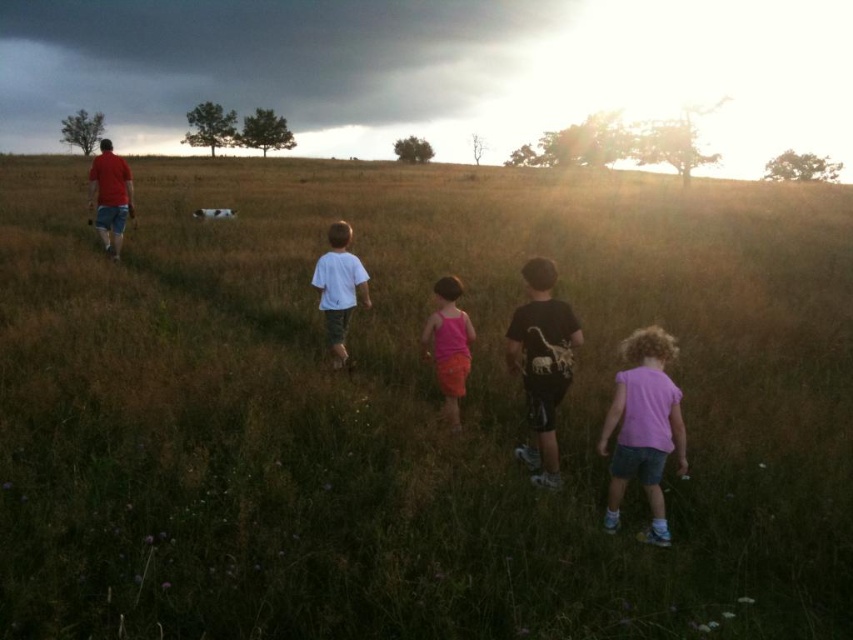
Who is higher up, pink fabric shirt at lower right or white cotton shirt at center?

white cotton shirt at center is above.

Based on the photo, does pink fabric shirt at lower right have a lesser height compared to white cotton shirt at center?

Yes.

Find the location of a particular element. The width and height of the screenshot is (853, 640). pink fabric shirt at lower right is located at coordinates (643, 426).

Is black matte t-shirt at center bigger than pink fabric dress at center?

Yes, black matte t-shirt at center is bigger than pink fabric dress at center.

In order to click on black matte t-shirt at center in this screenshot , I will do tap(543, 364).

Is pink fabric dress at center below white cotton shirt at center?

Correct, pink fabric dress at center is located below white cotton shirt at center.

Is pink fabric dress at center taller than white cotton shirt at center?

In fact, pink fabric dress at center may be shorter than white cotton shirt at center.

The width and height of the screenshot is (853, 640). Identify the location of pink fabric dress at center. (450, 344).